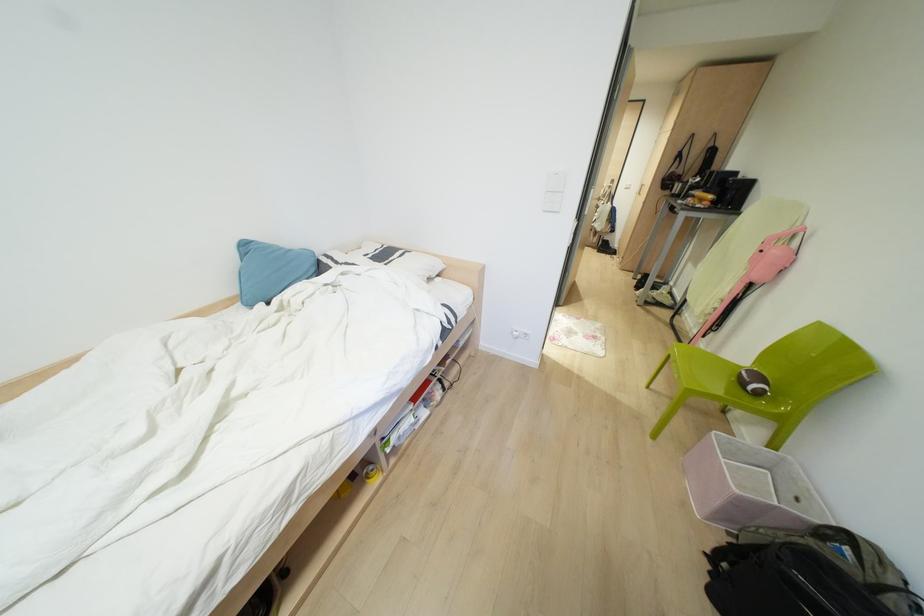
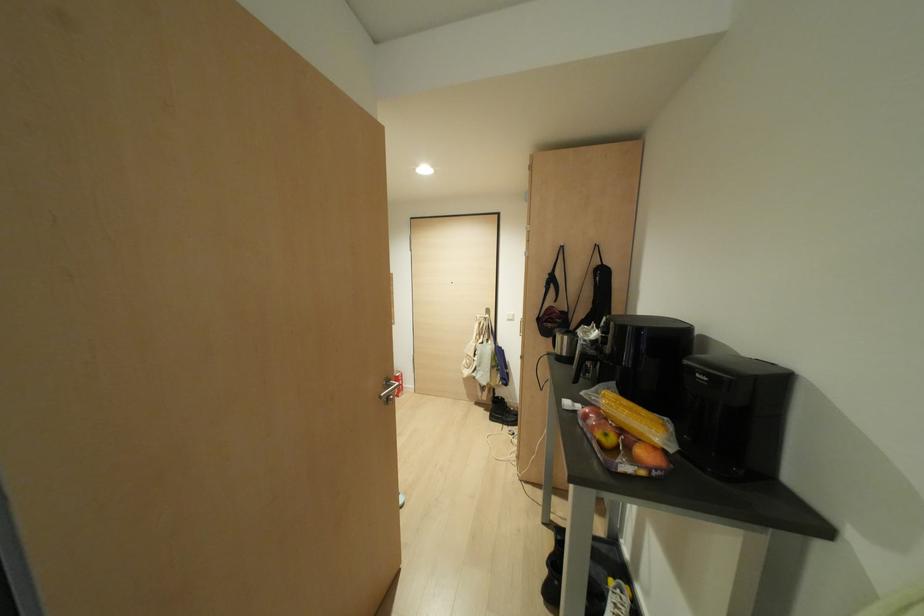
Where in the second image is the point corresponding to [613,209] from the first image?

(497, 352)